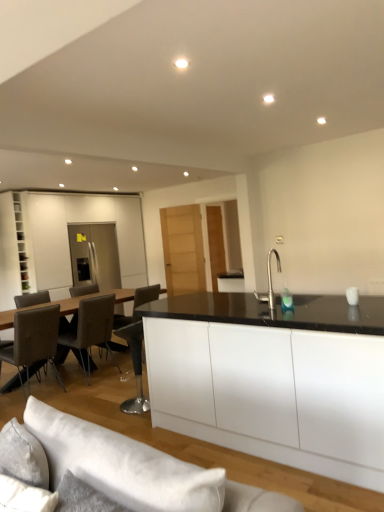
Question: From a real-world perspective, is white matte cabinet at left over leather/chrome chair at left, which is the 1th chair in left-to-right order?

Choices:
 (A) no
 (B) yes

Answer: (B)

Question: From a real-world perspective, is white matte cabinet at left below leather/chrome chair at left, which is the 1th chair in left-to-right order?

Choices:
 (A) yes
 (B) no

Answer: (B)

Question: Is white matte cabinet at left surrounding leather/chrome chair at left, which is the 1th chair in left-to-right order?

Choices:
 (A) no
 (B) yes

Answer: (A)

Question: Is white matte cabinet at left facing towards leather/chrome chair at left, which is the third chair from right to left?

Choices:
 (A) no
 (B) yes

Answer: (A)

Question: Considering the relative sizes of white matte cabinet at left and leather/chrome chair at left, which is the 1th chair in left-to-right order, in the image provided, is white matte cabinet at left smaller than leather/chrome chair at left, which is the 1th chair in left-to-right order,?

Choices:
 (A) no
 (B) yes

Answer: (B)

Question: From a real-world perspective, is leather/chrome chair at left, which is the 1th chair in left-to-right order, above or below leather bar stool at center, the 1th chair in the right-to-left sequence?

Choices:
 (A) below
 (B) above

Answer: (B)

Question: In terms of size, does leather/chrome chair at left, which is the 1th chair in left-to-right order, appear bigger or smaller than leather bar stool at center, positioned as the third chair in left-to-right order?

Choices:
 (A) big
 (B) small

Answer: (A)

Question: Would you say leather/chrome chair at left, which is the third chair from right to left, is inside or outside leather bar stool at center, the 1th chair in the right-to-left sequence?

Choices:
 (A) outside
 (B) inside

Answer: (A)

Question: Is point (38, 333) positioned closer to the camera than point (135, 412)?

Choices:
 (A) farther
 (B) closer

Answer: (A)

Question: In terms of height, does white fabric couch at lower center look taller or shorter compared to white matte cabinet at left?

Choices:
 (A) tall
 (B) short

Answer: (B)

Question: From a real-world perspective, is white fabric couch at lower center positioned above or below white matte cabinet at left?

Choices:
 (A) above
 (B) below

Answer: (B)

Question: Choose the correct answer: Is white fabric couch at lower center inside white matte cabinet at left or outside it?

Choices:
 (A) inside
 (B) outside

Answer: (B)

Question: Visually, is white fabric couch at lower center positioned to the left or to the right of white matte cabinet at left?

Choices:
 (A) right
 (B) left

Answer: (A)

Question: Considering the relative positions of leather at left, which is the second chair from left to right, and leather/chrome chair at left, which is the third chair from right to left, in the image provided, is leather at left, which is the second chair from left to right, to the left or to the right of leather/chrome chair at left, which is the third chair from right to left,?

Choices:
 (A) right
 (B) left

Answer: (A)

Question: From the image's perspective, is leather at left, acting as the 2th chair starting from the right, located above or below leather/chrome chair at left, which is the third chair from right to left?

Choices:
 (A) below
 (B) above

Answer: (B)